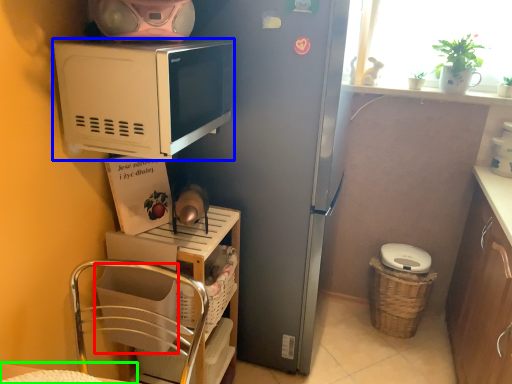
Question: Which is nearer to the basket (highlighted by a red box)? microwave oven (highlighted by a blue box) or table (highlighted by a green box).

Choices:
 (A) microwave oven
 (B) table

Answer: (B)